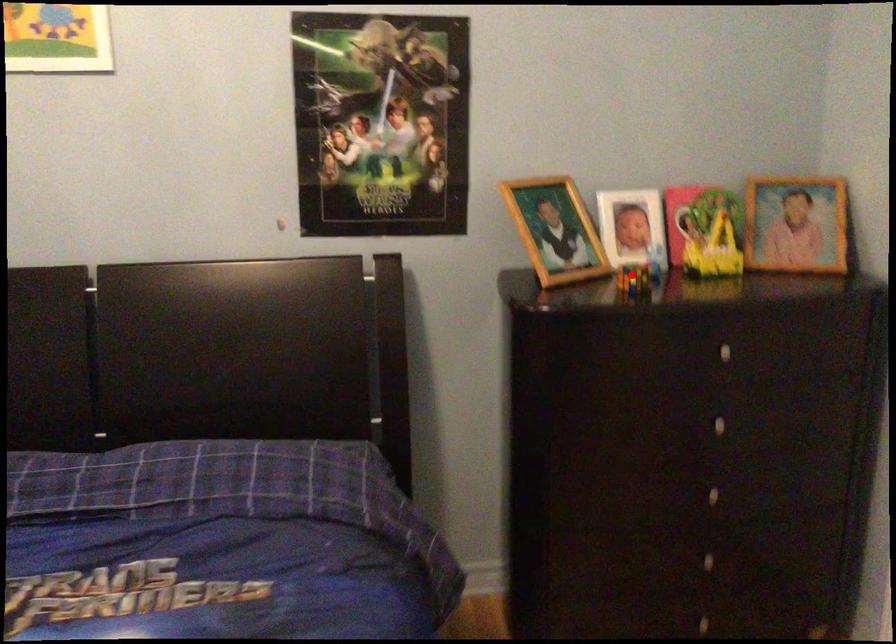
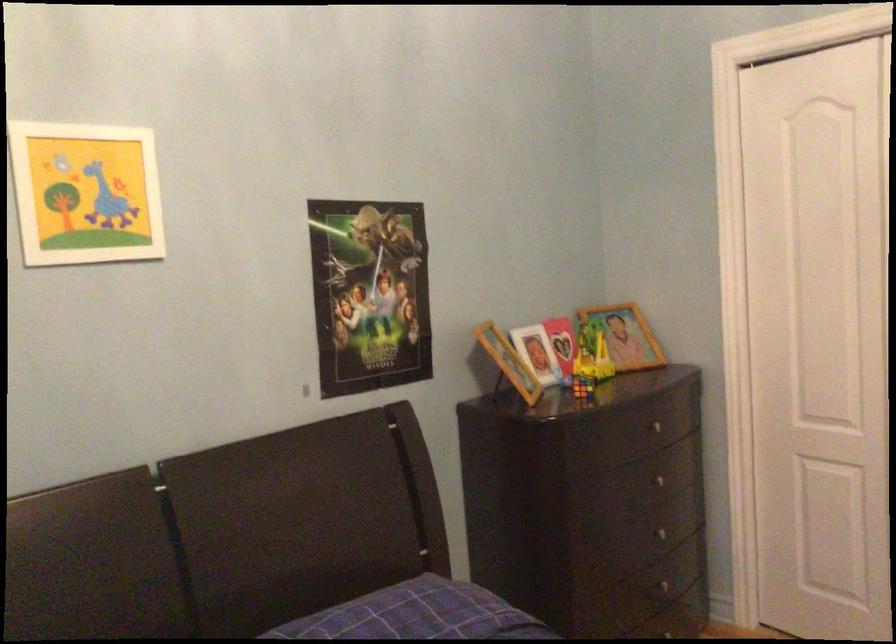
In the second image, find the point that corresponds to the highlighted location in the first image.

(582, 386)